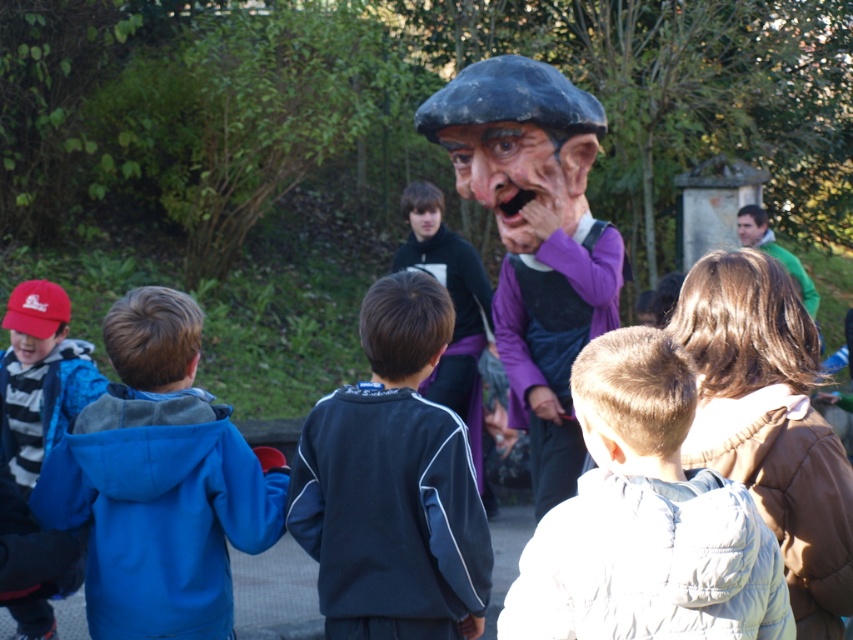
Does green fabric shirt at upper right appear under smooth skin face at center?

Yes.

Between green fabric shirt at upper right and smooth skin face at center, which one appears on the left side from the viewer's perspective?

Positioned to the left is smooth skin face at center.

The width and height of the screenshot is (853, 640). Describe the element at coordinates (775, 252) in the screenshot. I see `green fabric shirt at upper right` at that location.

You are a GUI agent. You are given a task and a screenshot of the screen. Output one action in this format:
    pyautogui.click(x=<x>, y=<y>)
    Task: Click on the green fabric shirt at upper right
    Image resolution: width=853 pixels, height=640 pixels.
    Given the screenshot: What is the action you would take?
    pyautogui.click(x=775, y=252)

Can you confirm if dark blue fleece jacket at center is bigger than matte purple costume at center?

Actually, dark blue fleece jacket at center might be smaller than matte purple costume at center.

Is dark blue fleece jacket at center further to camera compared to matte purple costume at center?

That is False.

Between point (378, 536) and point (613, 234), which one is positioned behind?

The point (613, 234) is more distant.

Where is `dark blue fleece jacket at center`? The height and width of the screenshot is (640, 853). dark blue fleece jacket at center is located at coordinates (392, 484).

Is dark blue fleece jacket at center smaller than matte purple mask at center?

Incorrect, dark blue fleece jacket at center is not smaller in size than matte purple mask at center.

Can you confirm if dark blue fleece jacket at center is positioned below matte purple mask at center?

Correct, dark blue fleece jacket at center is located below matte purple mask at center.

The width and height of the screenshot is (853, 640). In order to click on dark blue fleece jacket at center in this screenshot , I will do `click(392, 484)`.